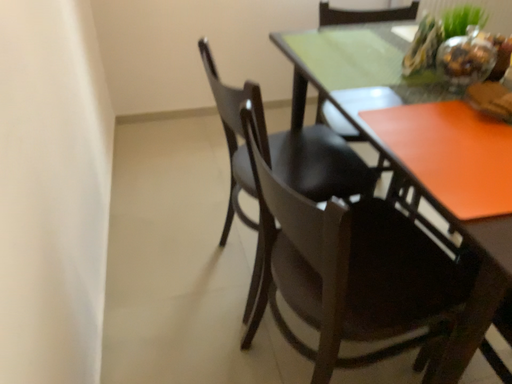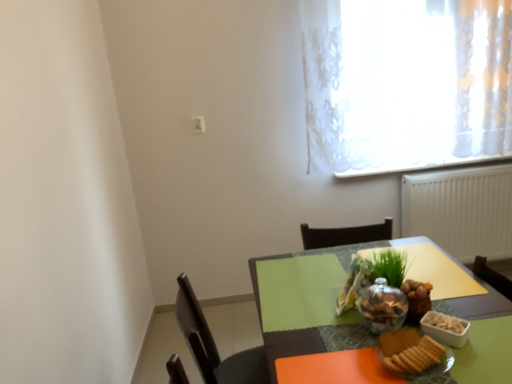
Question: How did the camera likely rotate when shooting the video?

Choices:
 (A) rotated downward
 (B) rotated upward

Answer: (B)